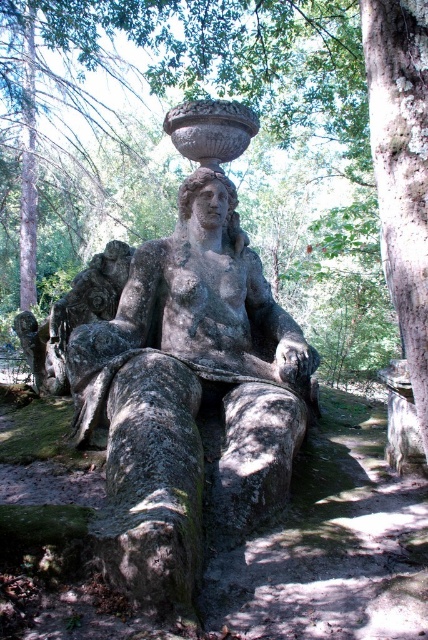
Question: Where is green rough bark tree at upper center located in relation to smooth bark tree trunk at right in the image?

Choices:
 (A) left
 (B) right

Answer: (A)

Question: Estimate the real-world distances between objects in this image. Which object is closer to the gray stone statue at center?

Choices:
 (A) smooth bark tree trunk at right
 (B) green rough bark tree at upper center

Answer: (A)

Question: Based on their relative distances, which object is nearer to the smooth bark tree trunk at right?

Choices:
 (A) gray stone statue at center
 (B) green rough bark tree at upper center

Answer: (A)

Question: Does green rough bark tree at upper center have a lesser width compared to gray stone statue at center?

Choices:
 (A) yes
 (B) no

Answer: (B)

Question: Is green rough bark tree at upper center to the left of gray stone statue at center from the viewer's perspective?

Choices:
 (A) yes
 (B) no

Answer: (B)

Question: Which object is closer to the camera taking this photo?

Choices:
 (A) smooth bark tree trunk at right
 (B) green rough bark tree at upper center
 (C) gray stone statue at center

Answer: (A)